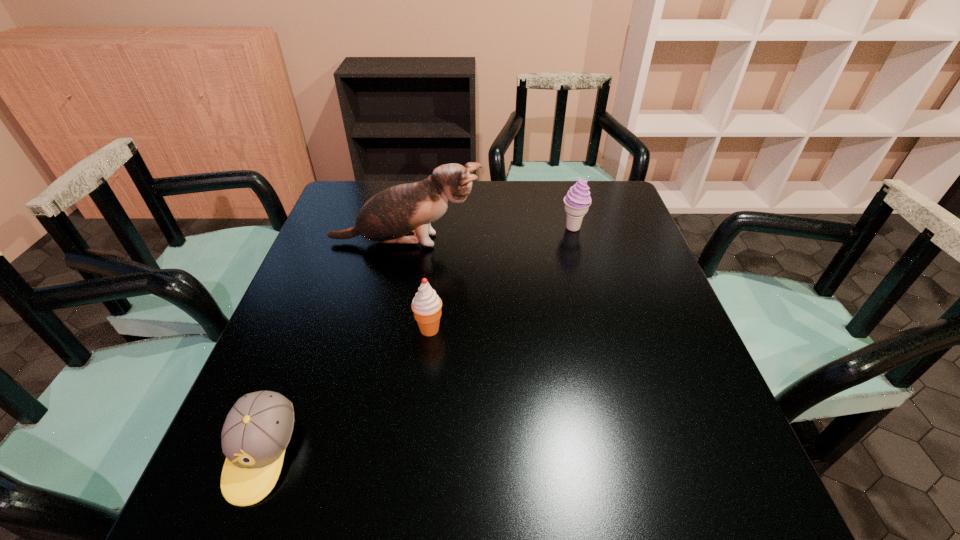
Where is `object at the far edge`? object at the far edge is located at coordinates (577, 201).

This screenshot has height=540, width=960. What are the coordinates of `object located at the near edge` in the screenshot? It's located at (257, 430).

I want to click on cat present at the left edge, so click(401, 214).

The width and height of the screenshot is (960, 540). In order to click on baseball cap that is at the left edge in this screenshot , I will do `click(257, 430)`.

Locate an element on the screen. The image size is (960, 540). object that is at the right edge is located at coordinates (577, 201).

In order to click on object located in the near left corner section of the desktop in this screenshot , I will do `click(257, 430)`.

Identify the location of object at the far right corner. (577, 201).

This screenshot has width=960, height=540. In order to click on vacant space at the far edge in this screenshot , I will do `click(450, 202)`.

Identify the location of free spot at the near edge of the desktop. (339, 488).

Where is `free space at the left edge of the desktop`? The height and width of the screenshot is (540, 960). free space at the left edge of the desktop is located at coordinates (311, 255).